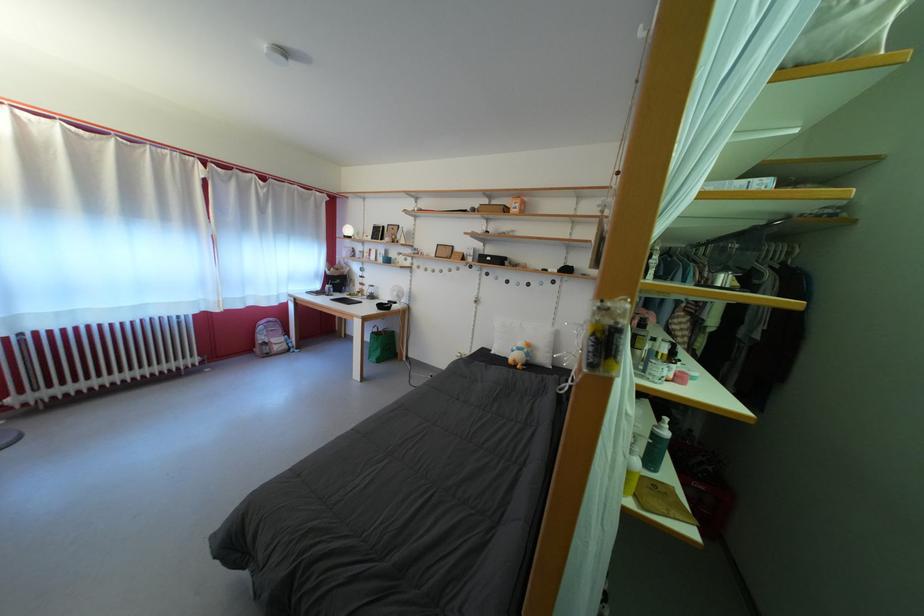
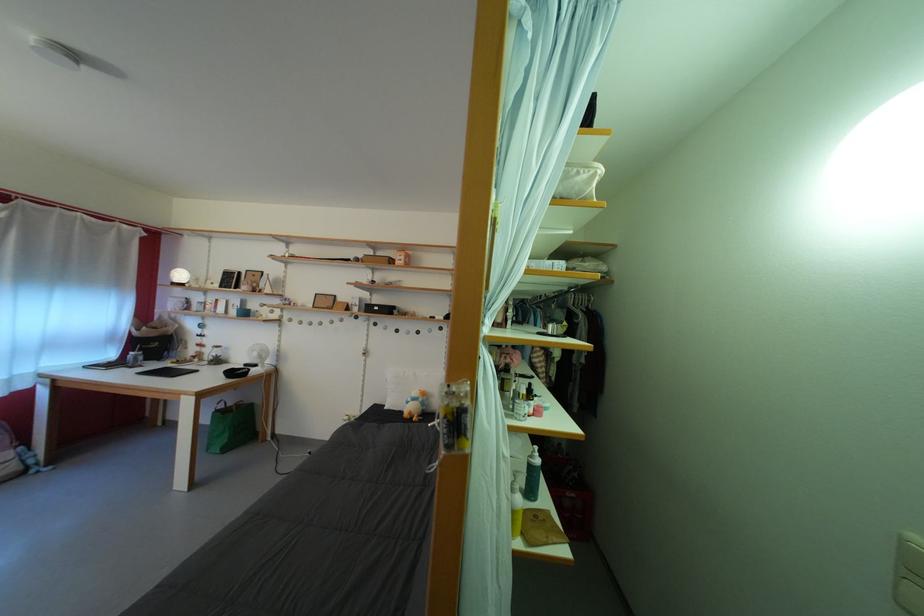
Find the pixel in the second image that matches pixel 400 261 in the first image.

(261, 312)